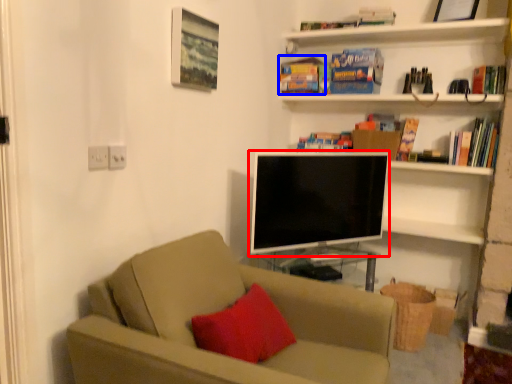
Question: Which object is closer to the camera taking this photo, television (highlighted by a red box) or paperback book (highlighted by a blue box)?

Choices:
 (A) television
 (B) paperback book

Answer: (A)